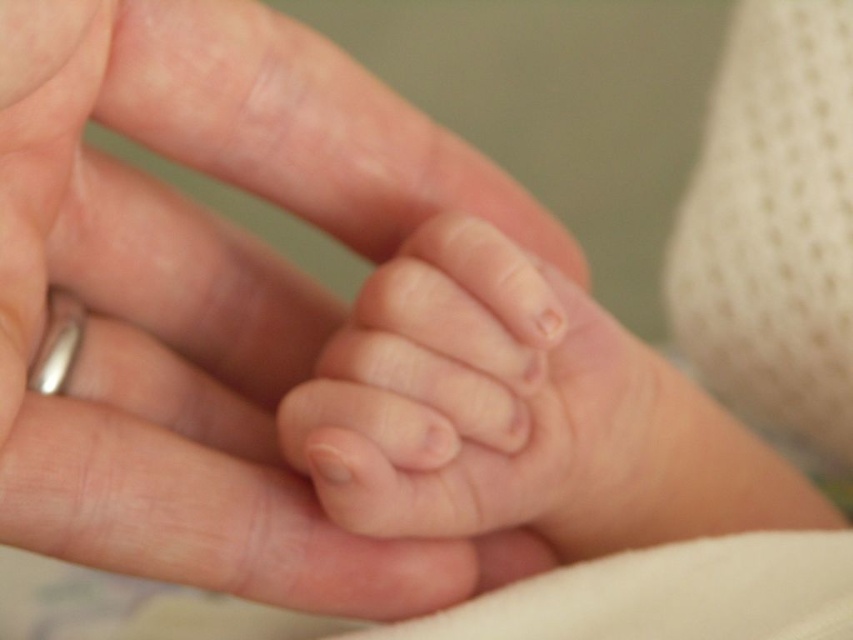
You are a photographer trying to capture the image. Given that the smooth skin hand at center and the smooth skin toe at center are both in focus, which one would appear larger in the photo?

The smooth skin hand at center is taller than the smooth skin toe at center, so it would appear larger in the photo.

What are the coordinates of the smooth skin hand at center?

The smooth skin hand at center is located at point (x=209, y=296).